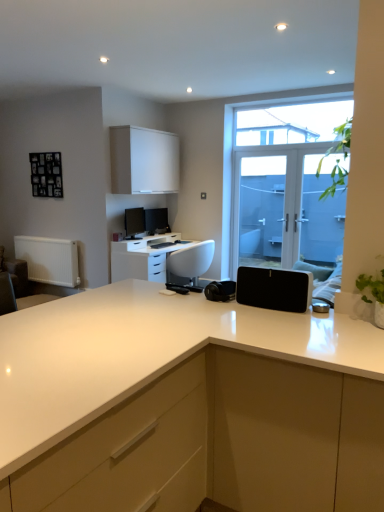
Question: Is matte black monitor at center, the 1th computer monitor in the back-to-front sequence, inside the boundaries of white glossy countertop at center, or outside?

Choices:
 (A) inside
 (B) outside

Answer: (B)

Question: From a real-world perspective, is matte black monitor at center, acting as the second computer monitor starting from the front, physically located above or below white glossy countertop at center?

Choices:
 (A) below
 (B) above

Answer: (B)

Question: Based on their relative distances, which object is nearer to the matte white cabinet at center, which is counted as the first cabinetry, starting from the right?

Choices:
 (A) white glossy desktop computer at center
 (B) black matte speaker at center
 (C) white glossy countertop at center
 (D) matte black monitor at center, the 1th computer monitor in the back-to-front sequence
 (E) transparent glass door at center

Answer: (C)

Question: Estimate the real-world distances between objects in this image. Which object is closer to the white glossy countertop at center?

Choices:
 (A) white glossy desktop computer at center
 (B) transparent glass door at center
 (C) white matte cabinet at upper center, which appears as the first cabinetry when viewed from the top
 (D) black matte speaker at center
 (E) white glossy desk at center

Answer: (D)